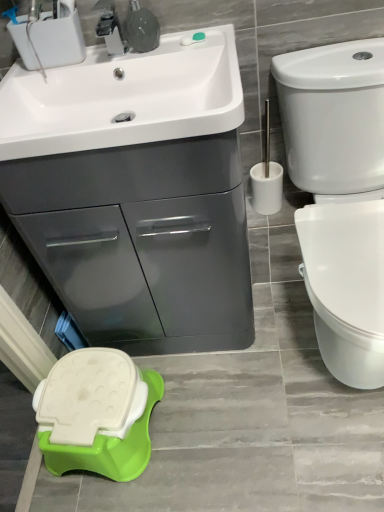
Question: Could you tell me if white glossy toilet at right is facing white glossy sink at upper left?

Choices:
 (A) no
 (B) yes

Answer: (A)

Question: From a real-world perspective, is white glossy toilet at right located higher than white glossy sink at upper left?

Choices:
 (A) yes
 (B) no

Answer: (B)

Question: Is white glossy toilet at right wider than white glossy sink at upper left?

Choices:
 (A) no
 (B) yes

Answer: (B)

Question: Is white glossy sink at upper left inside white glossy toilet at right?

Choices:
 (A) no
 (B) yes

Answer: (A)

Question: Is white glossy toilet at right not close to white glossy sink at upper left?

Choices:
 (A) yes
 (B) no

Answer: (B)

Question: Is green plastic stool at lower left in front of or behind white glossy toilet at right in the image?

Choices:
 (A) behind
 (B) front

Answer: (A)

Question: Would you say green plastic stool at lower left is to the left or to the right of white glossy toilet at right in the picture?

Choices:
 (A) left
 (B) right

Answer: (A)

Question: From their relative heights in the image, would you say green plastic stool at lower left is taller or shorter than white glossy toilet at right?

Choices:
 (A) tall
 (B) short

Answer: (B)

Question: From the image's perspective, relative to white glossy toilet at right, is green plastic stool at lower left above or below?

Choices:
 (A) above
 (B) below

Answer: (B)

Question: In terms of width, does white plastic toilet brush at right look wider or thinner when compared to white glossy toilet at right?

Choices:
 (A) wide
 (B) thin

Answer: (B)

Question: Considering the positions of point (273, 174) and point (284, 121), is point (273, 174) closer or farther from the camera than point (284, 121)?

Choices:
 (A) farther
 (B) closer

Answer: (A)

Question: Is white plastic toilet brush at right inside or outside of white glossy toilet at right?

Choices:
 (A) outside
 (B) inside

Answer: (A)

Question: From a real-world perspective, is white plastic toilet brush at right above or below white glossy toilet at right?

Choices:
 (A) above
 (B) below

Answer: (A)

Question: Is point (8, 117) positioned closer to the camera than point (147, 30)?

Choices:
 (A) farther
 (B) closer

Answer: (B)

Question: From the image's perspective, is white glossy sink at upper left located above or below brushed metal faucet at upper center?

Choices:
 (A) above
 (B) below

Answer: (B)